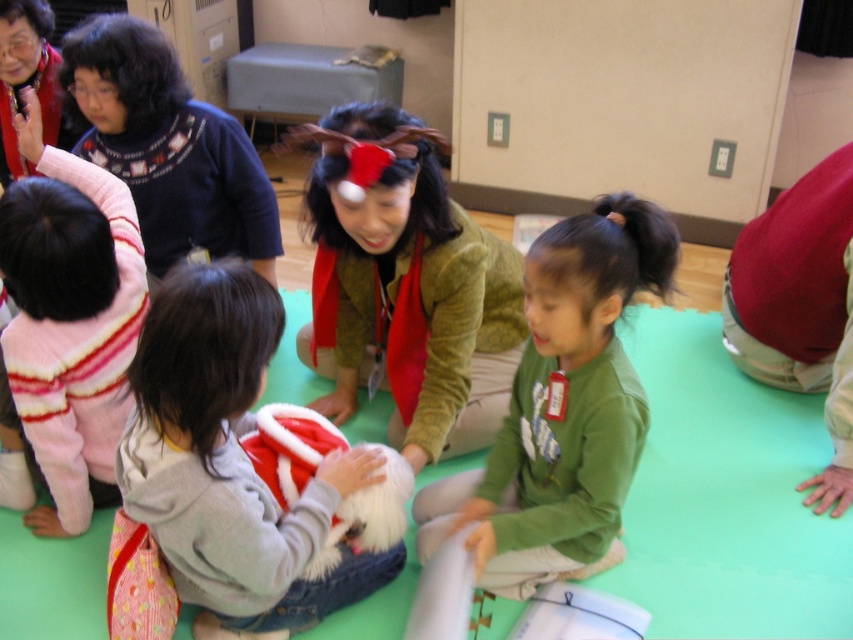
Does gray fleece hoodie at center come behind green matte shirt at center?

That is False.

Does gray fleece hoodie at center lie in front of green matte shirt at center?

That is True.

Identify the location of gray fleece hoodie at center. (231, 465).

Is green matte shirt at center bigger than blue sweater at upper left?

Yes.

Between point (538, 314) and point (193, 193), which one is positioned in front?

Point (538, 314)

In order to click on green matte shirt at center in this screenshot , I will do `click(561, 406)`.

Is green matte shirt at center further to camera compared to striped fleece sweater at upper left?

No, it is in front of striped fleece sweater at upper left.

Measure the distance between green matte shirt at center and camera.

A distance of 1.43 meters exists between green matte shirt at center and camera.

I want to click on green matte shirt at center, so click(x=561, y=406).